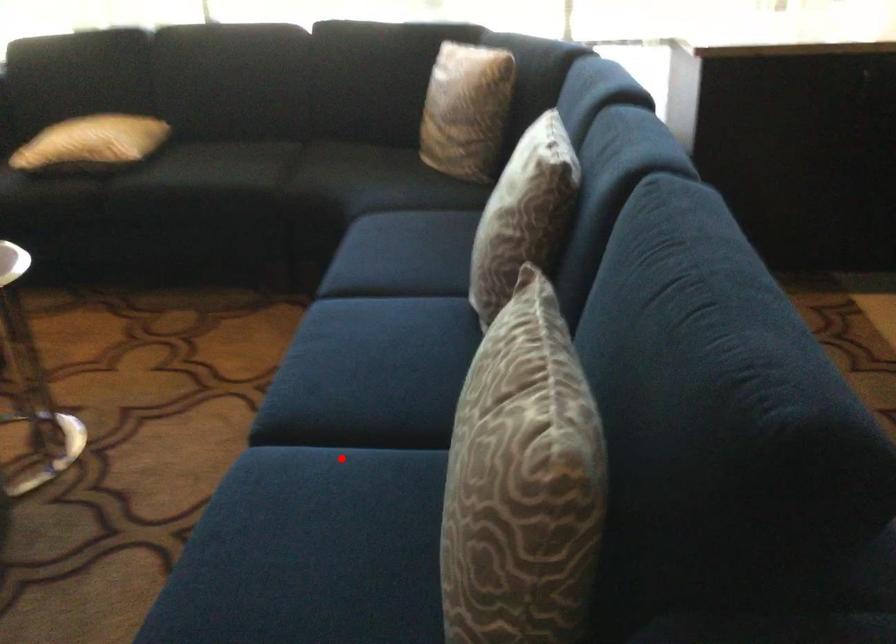
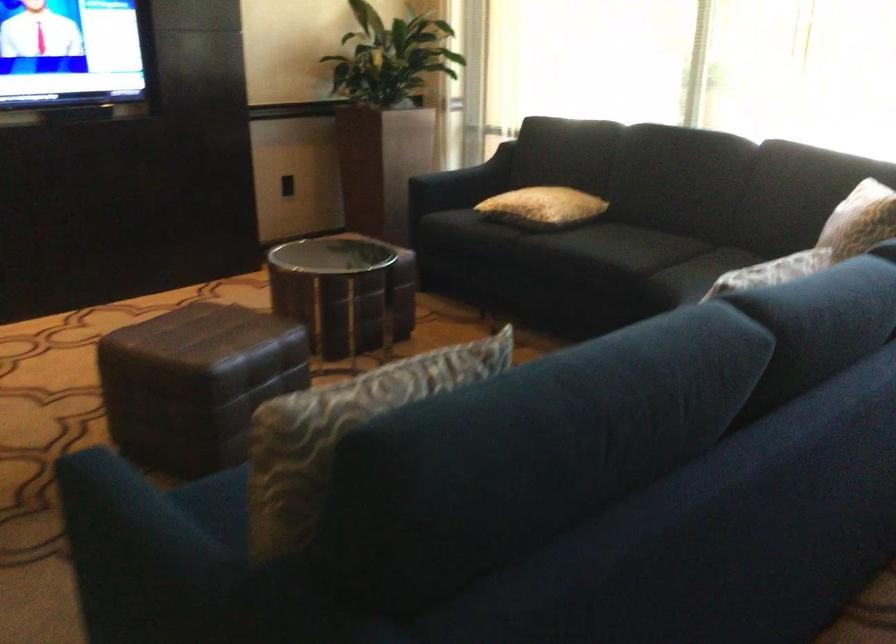
Question: I am providing you with two images of the same scene from different viewpoints. A red point is marked on the first image. Is the red point's position out of view in image 2?

Choices:
 (A) Yes
 (B) No

Answer: (A)